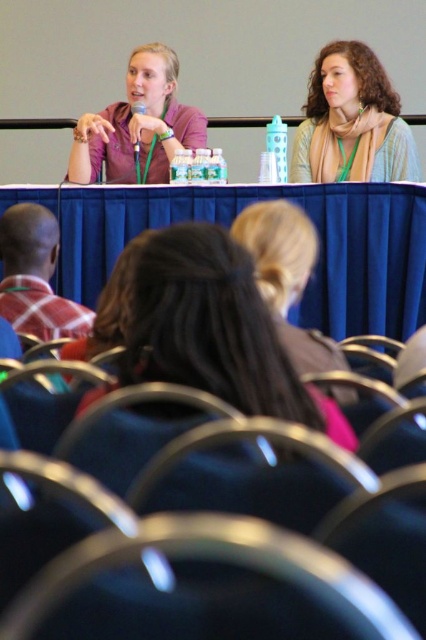
Question: Does blonde hair at center have a larger size compared to matte beige scarf at upper center?

Choices:
 (A) no
 (B) yes

Answer: (A)

Question: Is blue fabric table at center below matte purple shirt at upper left?

Choices:
 (A) no
 (B) yes

Answer: (B)

Question: Which object is the closest to the matte beige scarf at upper center?

Choices:
 (A) blue fabric table at center
 (B) matte purple shirt at upper left

Answer: (A)

Question: Which object is closer to the camera taking this photo?

Choices:
 (A) blue fabric table at center
 (B) matte beige scarf at upper center
 (C) blonde hair at center
 (D) matte purple shirt at upper left

Answer: (C)

Question: Can you confirm if blue fabric table at center is positioned above matte purple shirt at upper left?

Choices:
 (A) yes
 (B) no

Answer: (B)

Question: Which point is closer to the camera?

Choices:
 (A) (193, 316)
 (B) (92, 253)
 (C) (324, 147)
 (D) (135, 60)

Answer: (A)